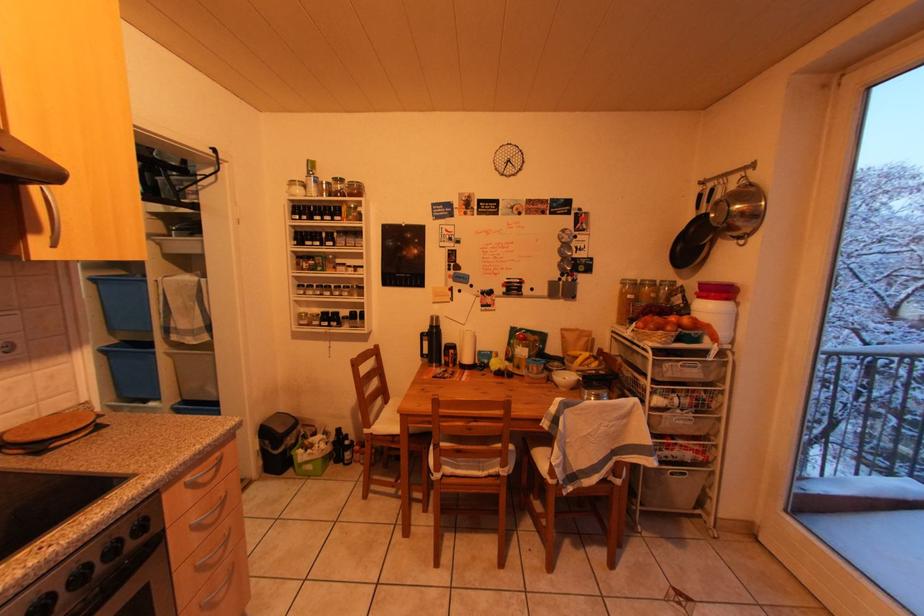
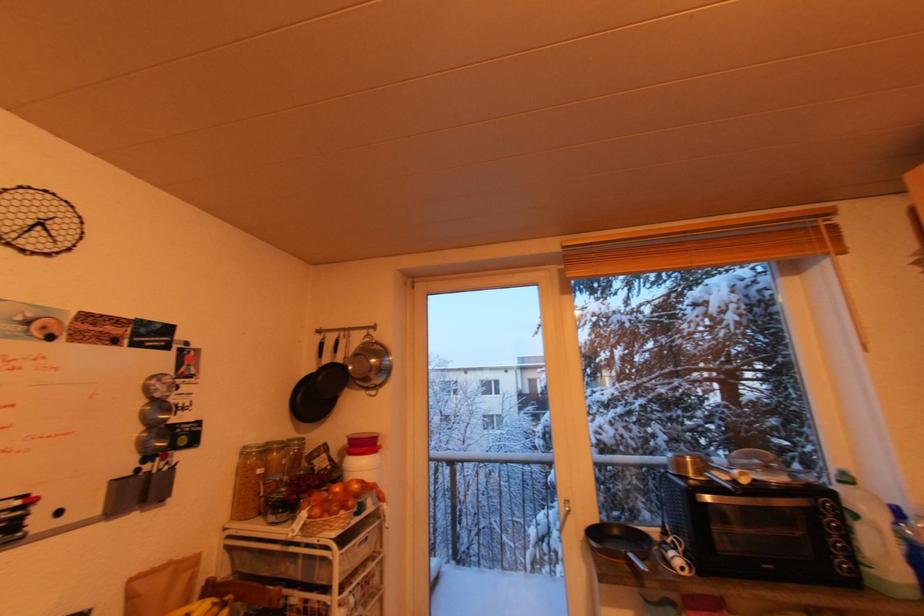
Question: The camera is either moving clockwise (left) or counter-clockwise (right) around the object. The first image is from the beginning of the video and the second image is from the end. Is the camera moving left or right when shooting the video?

Choices:
 (A) Left
 (B) Right

Answer: (A)